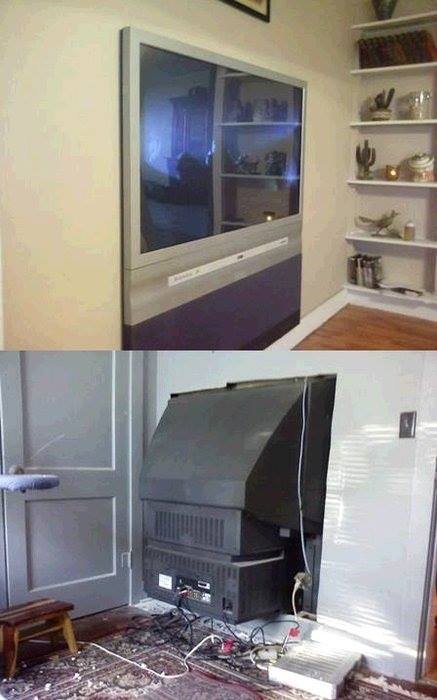
Identify the location of cable box. (320, 670).